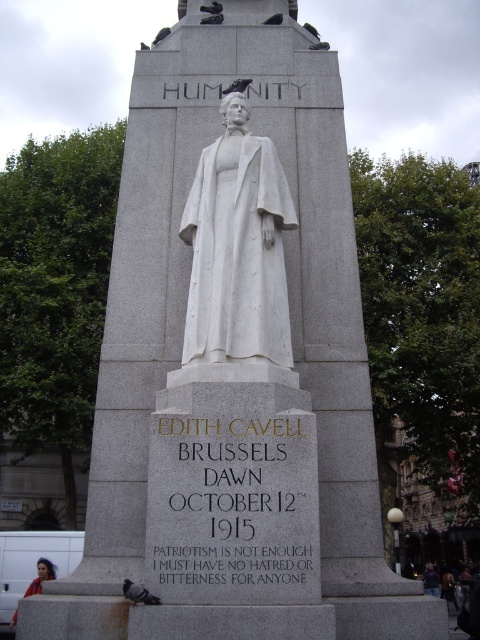
Is red jacket at lower left thinner than gray feathered pigeon at lower left?

Incorrect, red jacket at lower left's width is not less than gray feathered pigeon at lower left's.

Find the location of a particular element. This screenshot has height=640, width=480. red jacket at lower left is located at coordinates (40, 577).

In order to click on red jacket at lower left in this screenshot , I will do `click(40, 577)`.

Who is taller, red jacket at lower left or gray feathered pigeon at upper center?

Standing taller between the two is red jacket at lower left.

Between point (36, 586) and point (154, 38), which one is positioned behind?

The point (36, 586) is more distant.

Image resolution: width=480 pixels, height=640 pixels. What do you see at coordinates (40, 577) in the screenshot?
I see `red jacket at lower left` at bounding box center [40, 577].

Where is `red jacket at lower left`? This screenshot has width=480, height=640. red jacket at lower left is located at coordinates (40, 577).

Based on the photo, measure the distance between point [157,33] and camera.

The distance of point [157,33] from camera is 46.53 meters.

Is gray feathered pigeon at upper center taller than gray matte pigeon at upper center?

In fact, gray feathered pigeon at upper center may be shorter than gray matte pigeon at upper center.

At what (x,y) coordinates should I click in order to perform the action: click on gray feathered pigeon at upper center. Please return your answer as a coordinate pair (x, y). This screenshot has height=640, width=480. Looking at the image, I should click on (160, 35).

You are a GUI agent. You are given a task and a screenshot of the screen. Output one action in this format:
    pyautogui.click(x=<x>, y=<y>)
    Task: Click on the gray feathered pigeon at upper center
    The height and width of the screenshot is (640, 480).
    Given the screenshot: What is the action you would take?
    pyautogui.click(x=160, y=35)